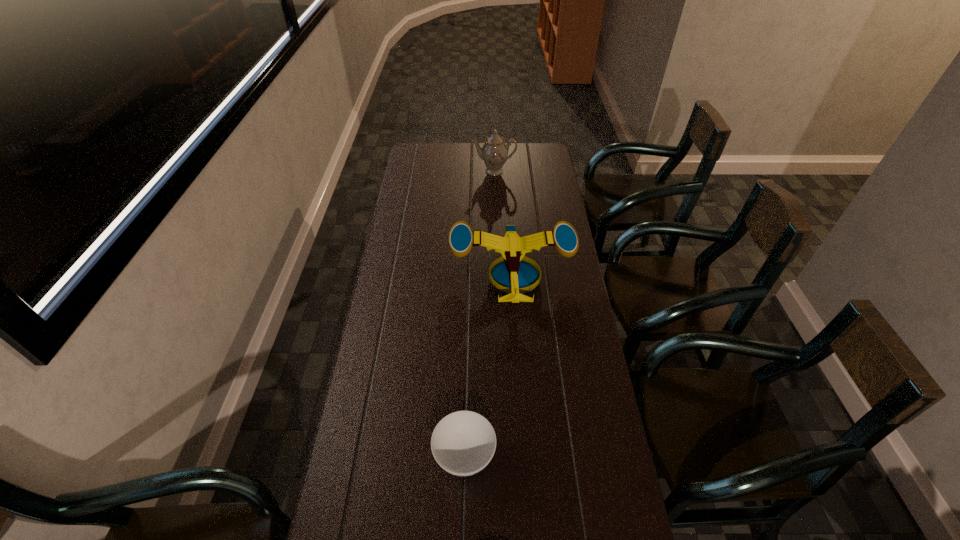
Locate which object is the second closest to the second shortest object. Please provide its 2D coordinates. Your answer should be formatted as a tuple, i.e. [(x, y)], where the tuple contains the x and y coordinates of a point satisfying the conditions above.

[(494, 152)]

Locate an element on the screen. The height and width of the screenshot is (540, 960). the closest object relative to the farther chinaware is located at coordinates (517, 274).